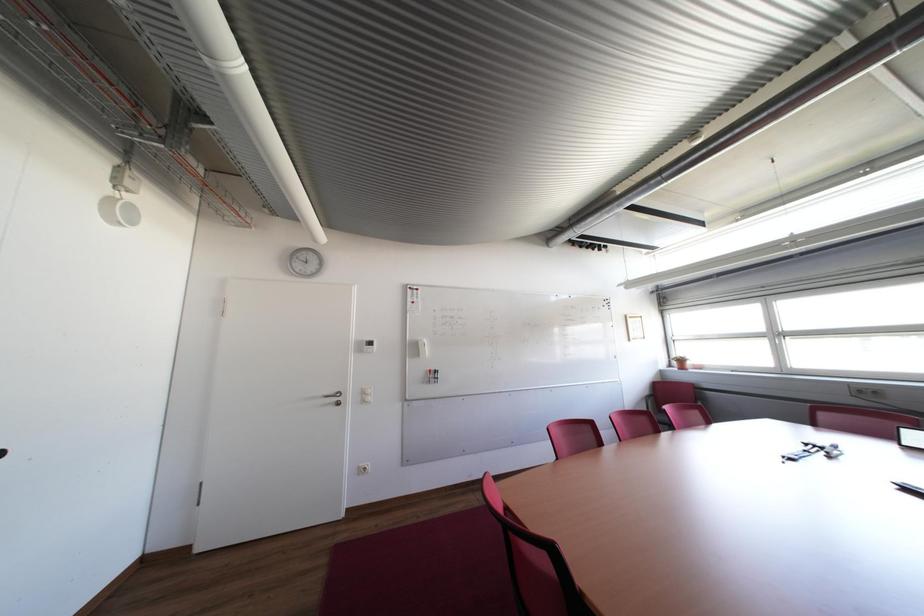
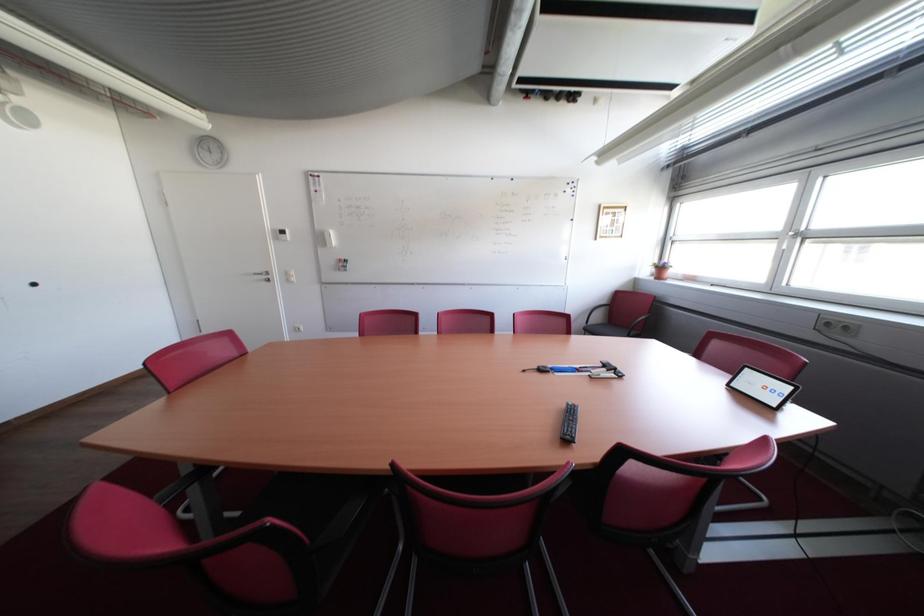
Question: Which direction would the cameraman need to move to produce the second image? Reply with the corresponding letter.

Choices:
 (A) Left
 (B) Right
 (C) Forward
 (D) Backward

Answer: (B)